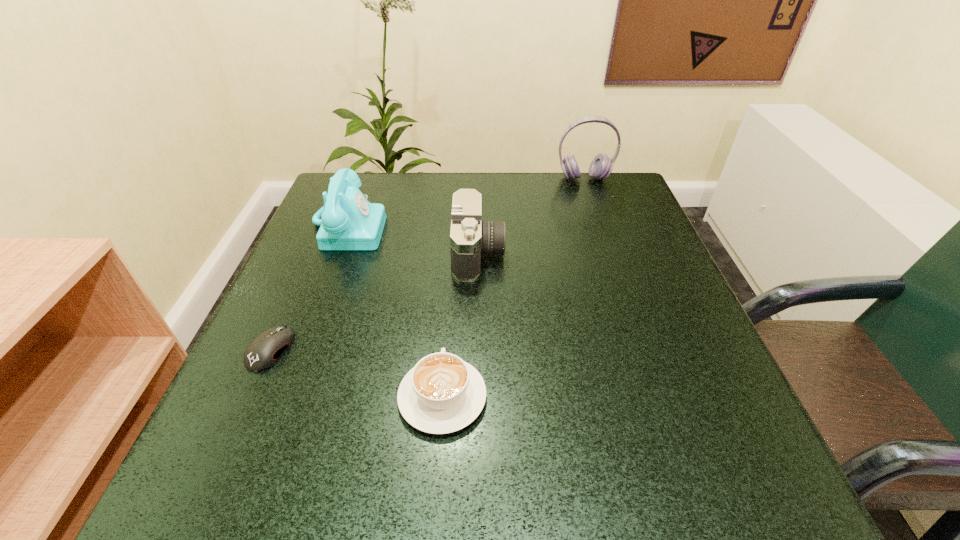
Where is `vacant space at the far edge`? This screenshot has height=540, width=960. vacant space at the far edge is located at coordinates (521, 195).

Where is `vacant space at the near edge of the desktop`? This screenshot has width=960, height=540. vacant space at the near edge of the desktop is located at coordinates (337, 492).

At what (x,y) coordinates should I click in order to perform the action: click on vacant space at the left edge of the desktop. Please return your answer as a coordinate pair (x, y). The image size is (960, 540). Looking at the image, I should click on (271, 407).

The height and width of the screenshot is (540, 960). What are the coordinates of `free space at the right edge` in the screenshot? It's located at (706, 373).

The image size is (960, 540). Identify the location of free space at the far right corner of the desktop. (582, 183).

This screenshot has height=540, width=960. What are the coordinates of `free region at the near right corner` in the screenshot? It's located at (741, 455).

Find the location of a particular element. This screenshot has height=540, width=960. vacant space that's between the farthest object and the third shortest object is located at coordinates (531, 216).

This screenshot has width=960, height=540. Find the location of `vacant area that lies between the shortest object and the camera`. vacant area that lies between the shortest object and the camera is located at coordinates (374, 301).

Find the location of `unoccupied position between the camera and the telephone`. unoccupied position between the camera and the telephone is located at coordinates (413, 240).

Where is `free space that is in between the second tallest object and the third shortest object`? Image resolution: width=960 pixels, height=540 pixels. free space that is in between the second tallest object and the third shortest object is located at coordinates (413, 240).